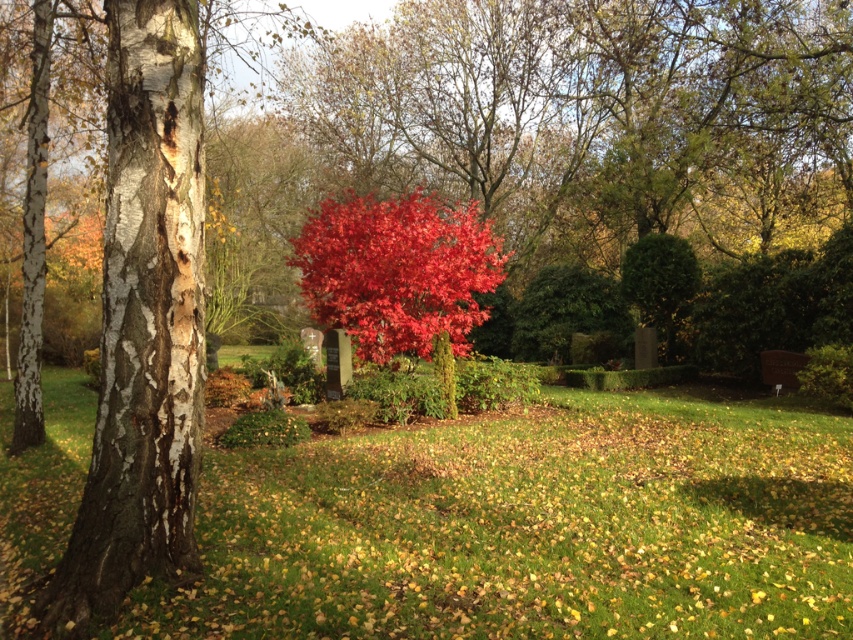
From the picture: You are standing in the autumn scene and want to place a small decorative rock between the green grass at center and the white bark birch tree at left. Based on their positions, where should you place the rock?

The green grass at center is to the right of the white bark birch tree at left, so you should place the rock between them along the line connecting their positions, ensuring it is equidistant from both.

You are a gardener assessing the landscape. You notice the green grass at center and the white bark birch tree at left. Which of these two has a greater height?

The white bark birch tree at left has a greater height compared to the green grass at center.

You are standing at the viewpoint of the image and want to walk towards the point labeled as point (303, 237). However, there is an obstacle at point (136, 124). Will you encounter this obstacle before reaching your destination?

Yes, you will encounter the obstacle at point (136, 124) before reaching point (303, 237) because point (136, 124) is in front of point (303, 237).